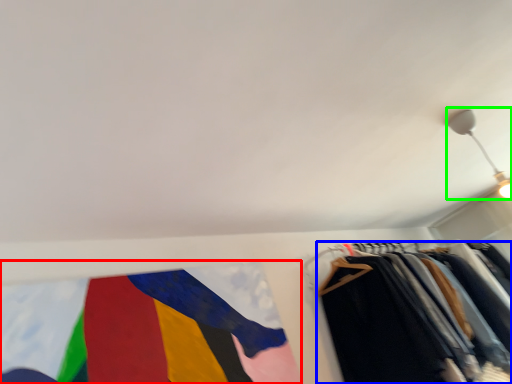
Question: Estimate the real-world distances between objects in this image. Which object is farther from flag (highlighted by a red box), trousers (highlighted by a blue box) or light fixture (highlighted by a green box)?

Choices:
 (A) trousers
 (B) light fixture

Answer: (B)